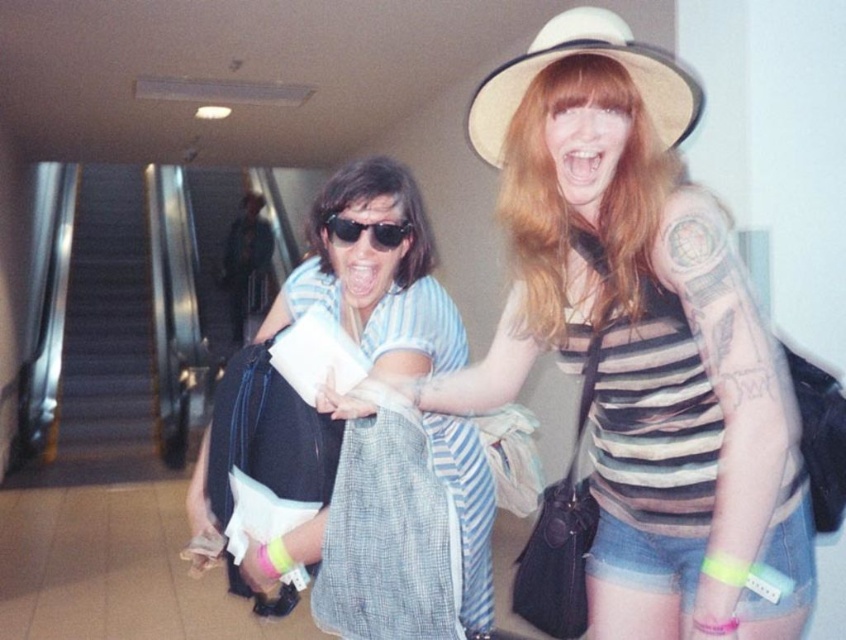
You are an observer in the scene. You see the blue striped shirt at center and the matte black sunglasses at center. Which object is positioned to the left?

The blue striped shirt at center is to the left of the matte black sunglasses at center.

You are standing at the position of point (72,358) and want to walk to the exit located at point (418,202). Given that the path between them is clear, which direction should you move relative to your current position?

You should move forward because point (418,202) is in front of point (72,358).

You are a security guard in the station and need to check the items of the person wearing the blue striped shirt at center and the matte black sunglasses at center. Which item is closer to you when you approach them?

The blue striped shirt at center is in front of the matte black sunglasses at center, so the blue striped shirt at center is closer to you when you approach them.